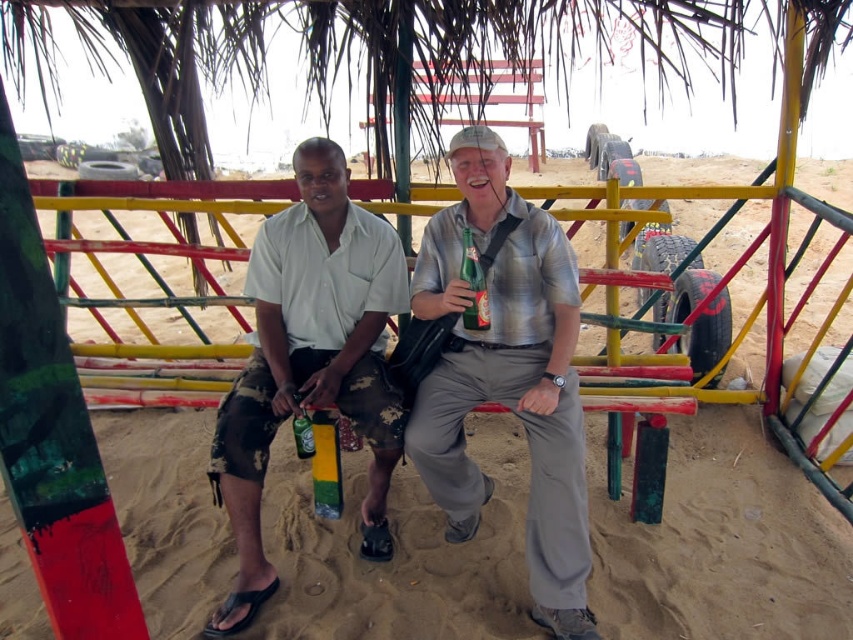
You are standing at the origin point in the image. There are two points marked in the scene. Which point is closer to you, point (335, 211) or point (465, 266)?

Point (465, 266) is closer to you because the description states that point (335, 211) is behind point (465, 266).